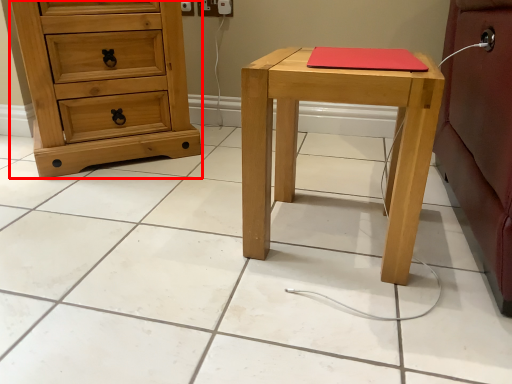
Question: Observing the image, what is the correct spatial positioning of chest of drawers (annotated by the red box) in reference to stool?

Choices:
 (A) right
 (B) left

Answer: (B)